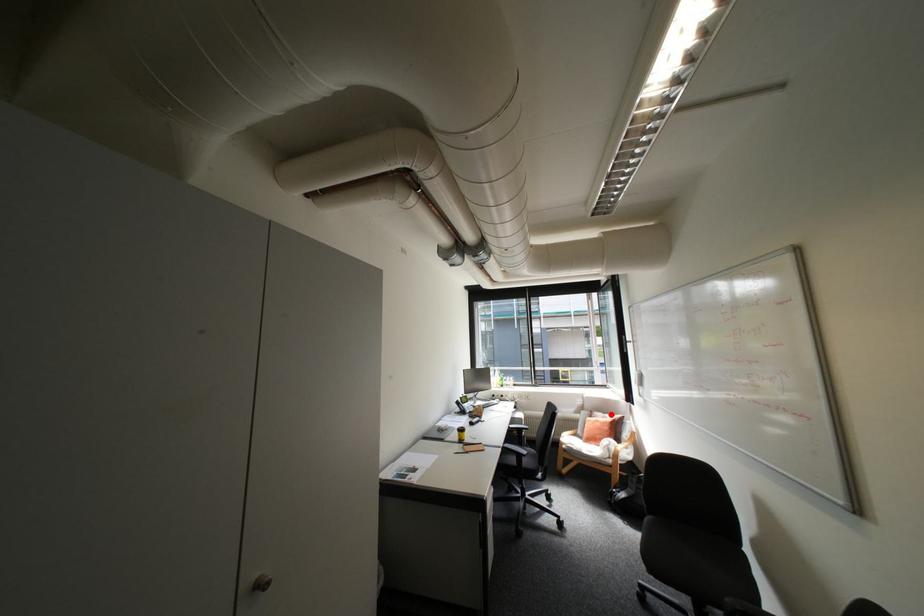
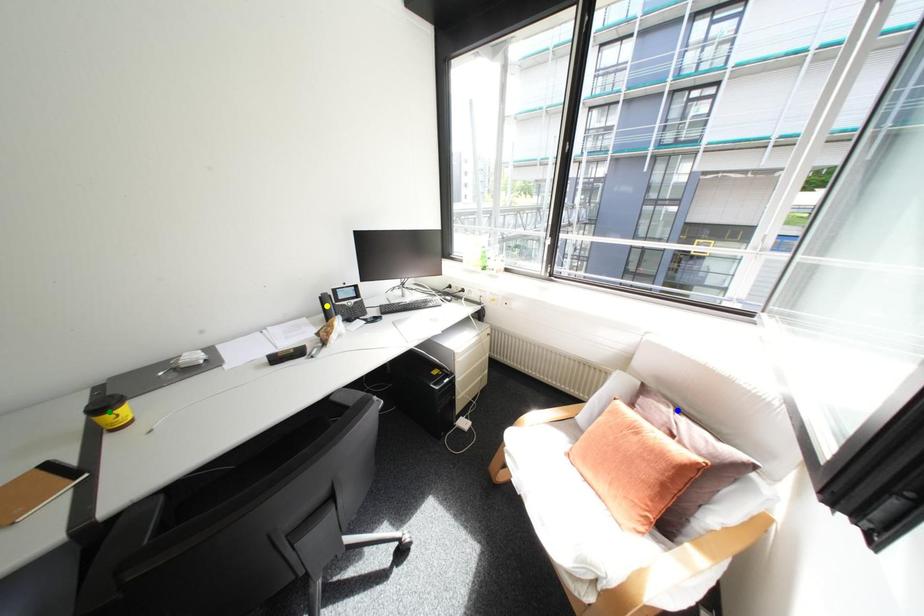
Question: I am providing you with two images of the same scene from different viewpoints. A red point is marked on the first image. You are given multiple points on the second image. Which point in image 2 represents the same 3d spot as the red point in image 1?

Choices:
 (A) yellow point
 (B) green point
 (C) blue point

Answer: (C)